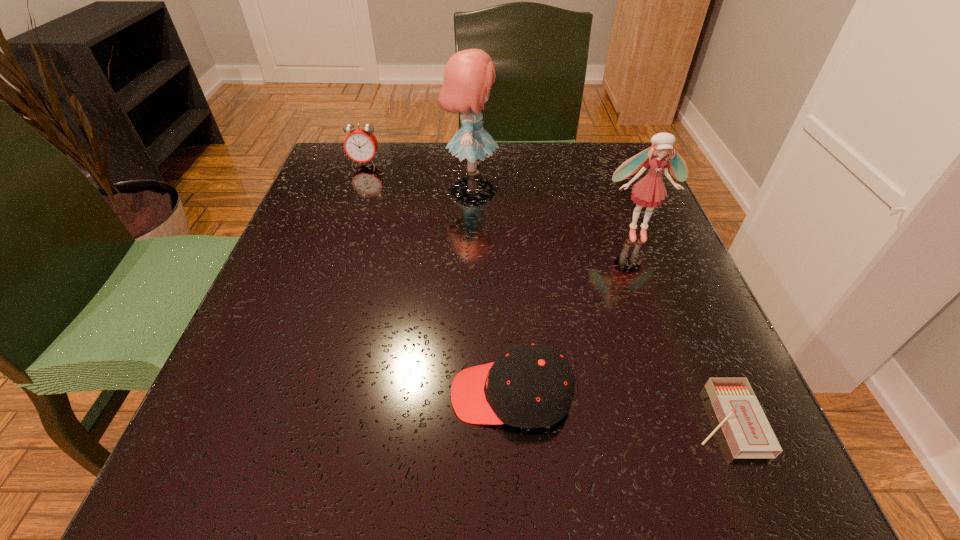
Identify the location of vacant space in between the leftmost object and the third farthest object. The image size is (960, 540). click(500, 198).

Identify which object is the fourth closest to the matchbox. Please provide its 2D coordinates. Your answer should be formatted as a tuple, i.e. [(x, y)], where the tuple contains the x and y coordinates of a point satisfying the conditions above.

[(360, 145)]

The width and height of the screenshot is (960, 540). Find the location of `object that is the third nearest to the cap`. object that is the third nearest to the cap is located at coordinates coord(469,74).

This screenshot has width=960, height=540. I want to click on free region that satisfies the following two spatial constraints: 1. on the front-facing side of the third farthest object; 2. on the front-facing side of the cap, so click(699, 394).

The height and width of the screenshot is (540, 960). Identify the location of free point that satisfies the following two spatial constraints: 1. on the front-facing side of the nearer doll; 2. on the front-facing side of the second shortest object. (699, 394).